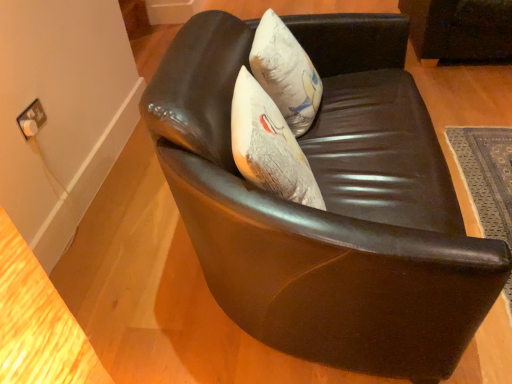
Question: From a real-world perspective, is white fabric pillow at center physically below dark gray woven mat at lower right?

Choices:
 (A) no
 (B) yes

Answer: (A)

Question: Could you tell me if white fabric pillow at center is facing dark gray woven mat at lower right?

Choices:
 (A) no
 (B) yes

Answer: (B)

Question: Is white fabric pillow at center oriented away from dark gray woven mat at lower right?

Choices:
 (A) yes
 (B) no

Answer: (B)

Question: Is dark gray woven mat at lower right located within white fabric pillow at center?

Choices:
 (A) yes
 (B) no

Answer: (B)

Question: Considering the relative sizes of white fabric pillow at center and dark gray woven mat at lower right in the image provided, is white fabric pillow at center taller than dark gray woven mat at lower right?

Choices:
 (A) yes
 (B) no

Answer: (A)

Question: Considering the relative positions of shiny black leather chair at center and dark gray woven mat at lower right in the image provided, is shiny black leather chair at center to the left or to the right of dark gray woven mat at lower right?

Choices:
 (A) right
 (B) left

Answer: (B)

Question: Does point (344, 220) appear closer or farther from the camera than point (501, 182)?

Choices:
 (A) closer
 (B) farther

Answer: (A)

Question: Relative to dark gray woven mat at lower right, is shiny black leather chair at center in front or behind?

Choices:
 (A) behind
 (B) front

Answer: (B)

Question: Choose the correct answer: Is shiny black leather chair at center inside dark gray woven mat at lower right or outside it?

Choices:
 (A) outside
 (B) inside

Answer: (A)

Question: Choose the correct answer: Is dark gray woven mat at lower right inside white fabric pillow at center or outside it?

Choices:
 (A) inside
 (B) outside

Answer: (B)

Question: Relative to white fabric pillow at center, is dark gray woven mat at lower right in front or behind?

Choices:
 (A) front
 (B) behind

Answer: (A)

Question: Is dark gray woven mat at lower right to the left or to the right of white fabric pillow at center in the image?

Choices:
 (A) left
 (B) right

Answer: (B)

Question: Is point (478, 145) positioned closer to the camera than point (306, 96)?

Choices:
 (A) farther
 (B) closer

Answer: (A)

Question: From their relative heights in the image, would you say white fabric pillow at center is taller or shorter than dark gray woven mat at lower right?

Choices:
 (A) tall
 (B) short

Answer: (A)

Question: Is white fabric pillow at center bigger or smaller than dark gray woven mat at lower right?

Choices:
 (A) small
 (B) big

Answer: (B)